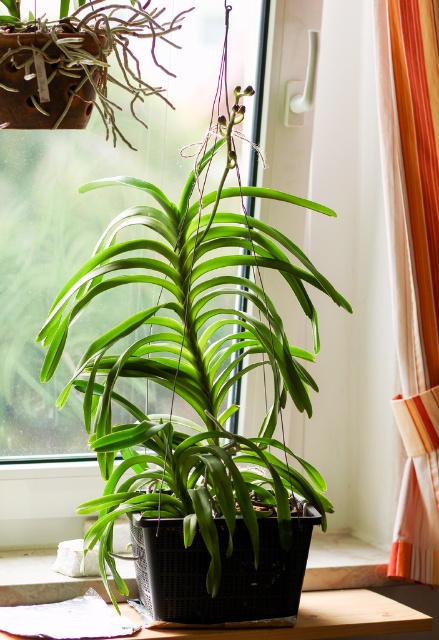
You are a window cleaner who needs to clean the transparent glass window at center and the rusty metal pot at upper left. Which object requires a taller ladder to reach?

The transparent glass window at center requires a taller ladder because it is much taller than the rusty metal pot at upper left.

You are a window cleaner who needs to clean the transparent glass window at center and the rusty metal pot at upper left. Which object requires a larger cleaning tool based on their sizes?

The transparent glass window at center is larger in size than the rusty metal pot at upper left, so the window requires a larger cleaning tool.

You are an interior designer assessing the space in the image. You need to determine if the orange striped fabric at right can be placed over the transparent glass window at center without covering the entire window. Can it fit?

The transparent glass window at center is larger than the orange striped fabric at right, so placing the orange striped fabric at right over the window would not cover the entire window.